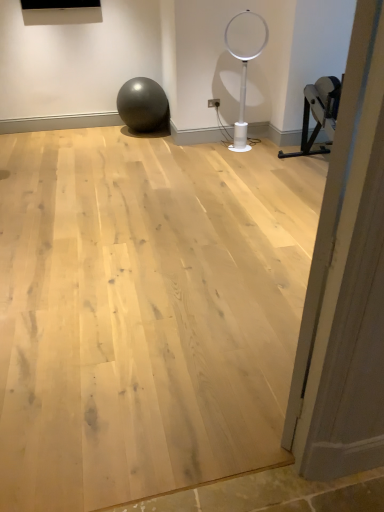
Locate an element on the screen. The width and height of the screenshot is (384, 512). blank space to the left of white plastic basketball hoop at center is located at coordinates (220, 146).